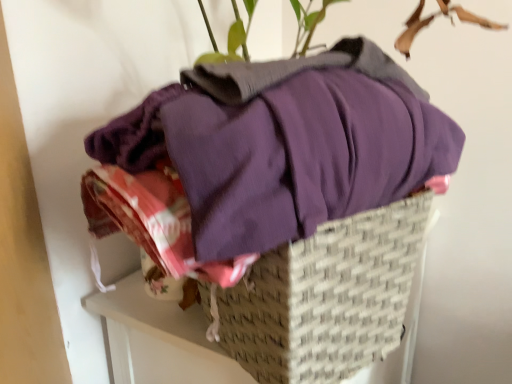
Locate an element on the screen. The image size is (512, 384). woven beige basket at center is located at coordinates (327, 297).

Locate an element on the screen. The width and height of the screenshot is (512, 384). green leafy plant at upper center is located at coordinates (434, 18).

The image size is (512, 384). Identify the location of purple cotton shirt at center. (302, 157).

Locate an element on the screen. The image size is (512, 384). woven beige basket at center is located at coordinates click(x=327, y=297).

Between green leafy plant at upper center and woven beige basket at center, which one has more height?

Standing taller between the two is woven beige basket at center.

Which is more to the left, green leafy plant at upper center or woven beige basket at center?

woven beige basket at center is more to the left.

From the image's perspective, is green leafy plant at upper center positioned above or below woven beige basket at center?

From the image's perspective, green leafy plant at upper center appears above woven beige basket at center.

Is green leafy plant at upper center oriented away from woven beige basket at center?

No, green leafy plant at upper center is not facing the opposite direction of woven beige basket at center.

Does woven beige basket at center turn towards green leafy plant at upper center?

No, woven beige basket at center is not turned towards green leafy plant at upper center.

Is woven beige basket at center located outside green leafy plant at upper center?

woven beige basket at center lies outside green leafy plant at upper center's area.

Between woven beige basket at center and green leafy plant at upper center, which one is positioned behind?

Positioned behind is woven beige basket at center.

Identify the location of basket behind the green leafy plant at upper center. (327, 297).

From the picture: Which object is closer to the camera, woven beige basket at center or purple cotton shirt at center?

purple cotton shirt at center is closer to the camera.

Is woven beige basket at center facing away from purple cotton shirt at center?

No.

Between point (360, 326) and point (186, 104), which one is positioned behind?

Positioned behind is point (360, 326).

Is purple cotton shirt at center positioned with its back to woven beige basket at center?

No, woven beige basket at center is not at the back of purple cotton shirt at center.

Which object is more forward, purple cotton shirt at center or woven beige basket at center?

Positioned in front is purple cotton shirt at center.

Is point (376, 111) less distant than point (382, 360)?

Yes.

Is purple cotton shirt at center not close to woven beige basket at center?

No, purple cotton shirt at center is not far away from woven beige basket at center.

From a real-world perspective, is green leafy plant at upper center physically below purple cotton shirt at center?

No.

Where is `clothing behind the green leafy plant at upper center`? This screenshot has height=384, width=512. clothing behind the green leafy plant at upper center is located at coordinates (302, 157).

Does green leafy plant at upper center touch purple cotton shirt at center?

No, green leafy plant at upper center is not touching purple cotton shirt at center.

What's the angular difference between green leafy plant at upper center and purple cotton shirt at center's facing directions?

26.7 degrees separate the facing orientations of green leafy plant at upper center and purple cotton shirt at center.

From a real-world perspective, relative to green leafy plant at upper center, is purple cotton shirt at center vertically above or below?

Clearly, from a real-world perspective, purple cotton shirt at center is below green leafy plant at upper center.

Could you tell me if purple cotton shirt at center is facing green leafy plant at upper center?

No, purple cotton shirt at center is not oriented towards green leafy plant at upper center.

Is purple cotton shirt at center inside the boundaries of green leafy plant at upper center, or outside?

purple cotton shirt at center is not enclosed by green leafy plant at upper center.

Is purple cotton shirt at center shorter than green leafy plant at upper center?

In fact, purple cotton shirt at center may be taller than green leafy plant at upper center.

Locate an element on the screen. Image resolution: width=512 pixels, height=384 pixels. basket directly beneath the green leafy plant at upper center (from a real-world perspective) is located at coordinates (327, 297).

Locate an element on the screen. This screenshot has height=384, width=512. basket that appears below the green leafy plant at upper center (from the image's perspective) is located at coordinates (327, 297).

Considering their positions, is green leafy plant at upper center positioned closer to woven beige basket at center than purple cotton shirt at center?

Based on the image, purple cotton shirt at center appears to be nearer to woven beige basket at center.

Based on the photo, which object lies further to the anchor point purple cotton shirt at center, woven beige basket at center or green leafy plant at upper center?

Based on the image, green leafy plant at upper center appears to be further to purple cotton shirt at center.

Based on their spatial positions, is purple cotton shirt at center or woven beige basket at center closer to green leafy plant at upper center?

purple cotton shirt at center is closer to green leafy plant at upper center.

When comparing their distances from woven beige basket at center, does purple cotton shirt at center or green leafy plant at upper center seem further?

green leafy plant at upper center is further to woven beige basket at center.

Estimate the real-world distances between objects in this image. Which object is further from purple cotton shirt at center, green leafy plant at upper center or woven beige basket at center?

green leafy plant at upper center is positioned further to the anchor purple cotton shirt at center.

Considering their positions, is woven beige basket at center positioned further to green leafy plant at upper center than purple cotton shirt at center?

woven beige basket at center is positioned further to the anchor green leafy plant at upper center.

I want to click on clothing that lies between green leafy plant at upper center and woven beige basket at center from top to bottom, so click(x=302, y=157).